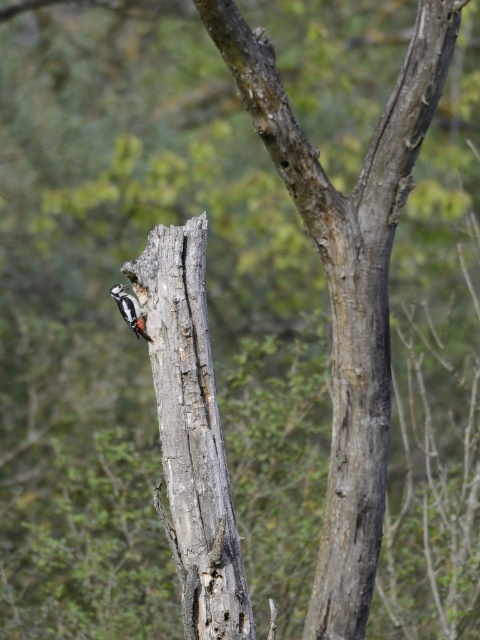
Which is in front, point (205, 365) or point (123, 298)?

Positioned in front is point (205, 365).

The image size is (480, 640). What are the coordinates of `gray rough bark tree trunk at center` in the screenshot? It's located at (192, 433).

Is point (228, 577) closer to camera compared to point (135, 312)?

Yes, it is.

Image resolution: width=480 pixels, height=640 pixels. I want to click on gray rough bark tree trunk at center, so click(x=192, y=433).